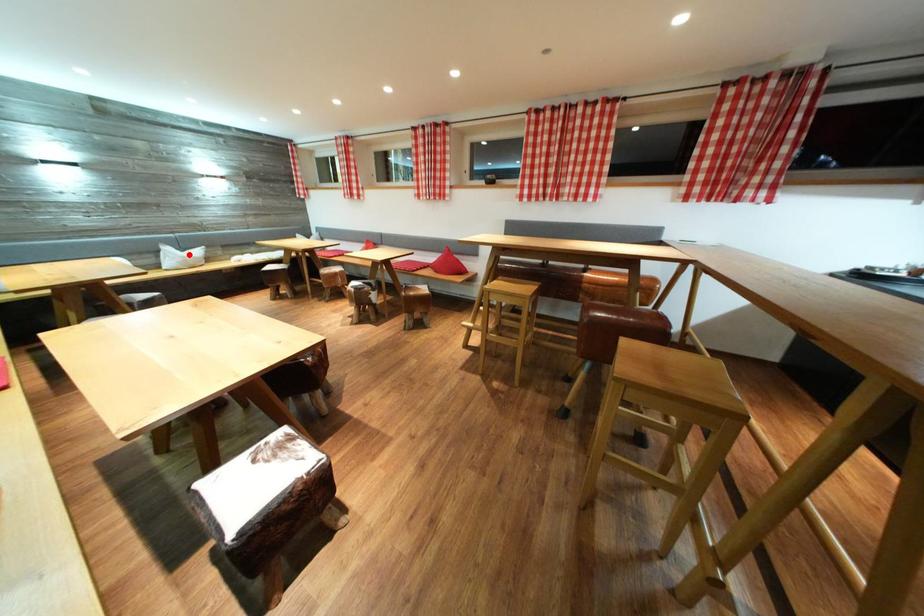
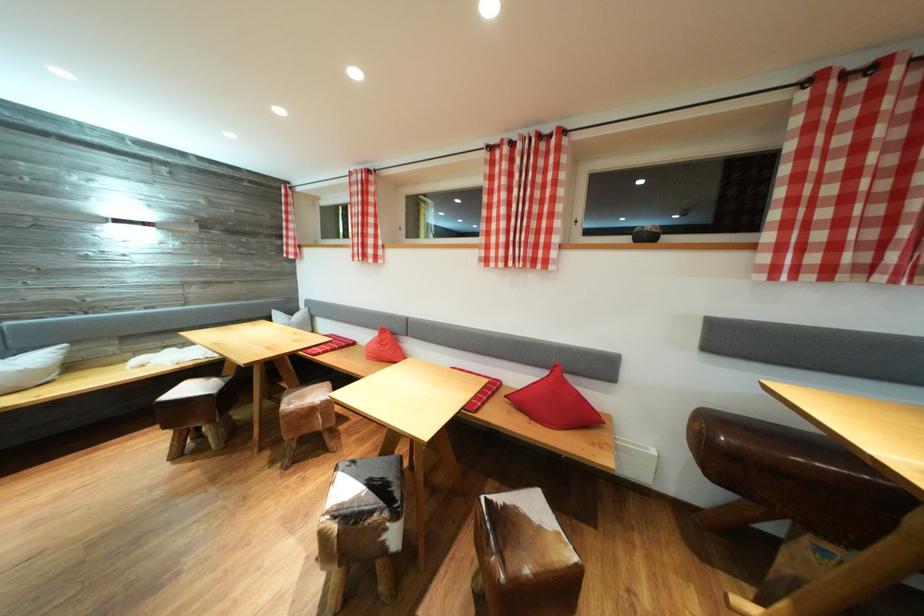
Find the pixel in the second image that matches the highlighted location in the first image.

(14, 358)